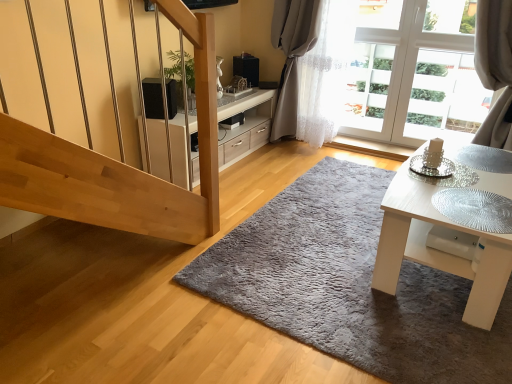
Find the location of a particular element. The image size is (512, 384). free space to the left of white glossy table at lower right is located at coordinates (312, 238).